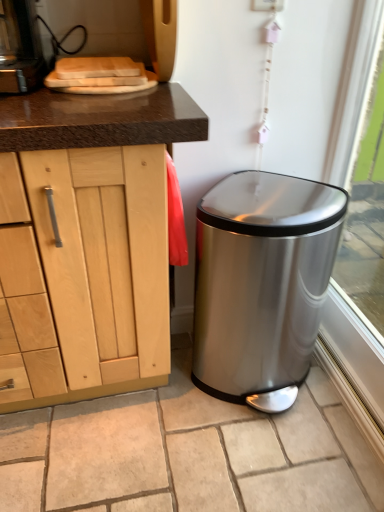
Question: From a real-world perspective, does satin silver trash can at lower right stand above polished stainless steel trash can at lower right?

Choices:
 (A) yes
 (B) no

Answer: (B)

Question: Is satin silver trash can at lower right bigger than polished stainless steel trash can at lower right?

Choices:
 (A) no
 (B) yes

Answer: (A)

Question: Would you say polished stainless steel trash can at lower right is part of satin silver trash can at lower right's contents?

Choices:
 (A) yes
 (B) no

Answer: (B)

Question: Considering the relative sizes of satin silver trash can at lower right and polished stainless steel trash can at lower right in the image provided, is satin silver trash can at lower right smaller than polished stainless steel trash can at lower right?

Choices:
 (A) yes
 (B) no

Answer: (A)

Question: From a real-world perspective, is satin silver trash can at lower right physically below polished stainless steel trash can at lower right?

Choices:
 (A) no
 (B) yes

Answer: (B)

Question: Are satin silver trash can at lower right and polished stainless steel trash can at lower right located far from each other?

Choices:
 (A) yes
 (B) no

Answer: (B)

Question: From the image's perspective, is transparent glass window at lower right below polished stainless steel trash can at lower right?

Choices:
 (A) yes
 (B) no

Answer: (B)

Question: Does transparent glass window at lower right contain polished stainless steel trash can at lower right?

Choices:
 (A) yes
 (B) no

Answer: (B)

Question: Does transparent glass window at lower right have a greater height compared to polished stainless steel trash can at lower right?

Choices:
 (A) no
 (B) yes

Answer: (B)

Question: Is transparent glass window at lower right outside of polished stainless steel trash can at lower right?

Choices:
 (A) yes
 (B) no

Answer: (A)

Question: Considering the relative positions of transparent glass window at lower right and polished stainless steel trash can at lower right in the image provided, is transparent glass window at lower right in front of polished stainless steel trash can at lower right?

Choices:
 (A) yes
 (B) no

Answer: (A)

Question: Is transparent glass window at lower right at the left side of polished stainless steel trash can at lower right?

Choices:
 (A) yes
 (B) no

Answer: (B)

Question: Can you confirm if polished stainless steel trash can at lower right is thinner than transparent glass window at lower right?

Choices:
 (A) yes
 (B) no

Answer: (B)